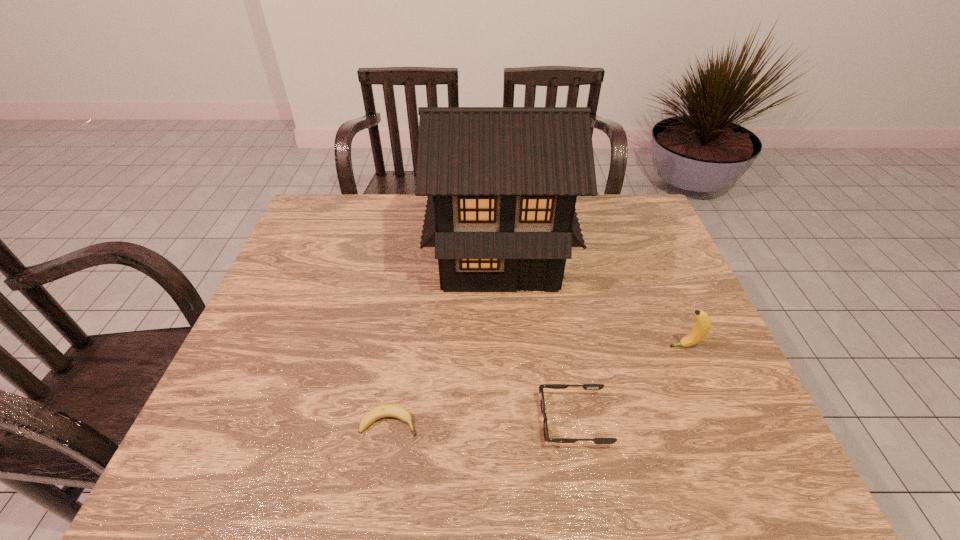
The image size is (960, 540). I want to click on free space located from the stem of the taller banana, so [x=516, y=346].

Locate an element on the screen. The width and height of the screenshot is (960, 540). vacant space located on the temples of the sunglasses is located at coordinates click(507, 421).

At what (x,y) coordinates should I click in order to perform the action: click on free space located on the temples of the sunglasses. Please return your answer as a coordinate pair (x, y). Image resolution: width=960 pixels, height=540 pixels. Looking at the image, I should click on (404, 421).

Image resolution: width=960 pixels, height=540 pixels. In order to click on vacant space situated 0.220m on the temples of the sunglasses in this screenshot , I will do `click(437, 421)`.

Locate an element on the screen. The width and height of the screenshot is (960, 540). vacant region located at the stem of the shortest object is located at coordinates (583, 423).

You are a GUI agent. You are given a task and a screenshot of the screen. Output one action in this format:
    pyautogui.click(x=<x>, y=<y>)
    Task: Click on the object positioned at the far edge
    This screenshot has width=960, height=540.
    Given the screenshot: What is the action you would take?
    pyautogui.click(x=502, y=182)

Find the location of a particular element. object situated at the near edge is located at coordinates (551, 386).

At what (x,y) coordinates should I click in order to perform the action: click on object at the right edge. Please return your answer as a coordinate pair (x, y). The height and width of the screenshot is (540, 960). Looking at the image, I should click on (701, 328).

Locate an element on the screen. Image resolution: width=960 pixels, height=540 pixels. vacant area at the far edge is located at coordinates (414, 213).

I want to click on vacant region at the near edge, so click(x=422, y=483).